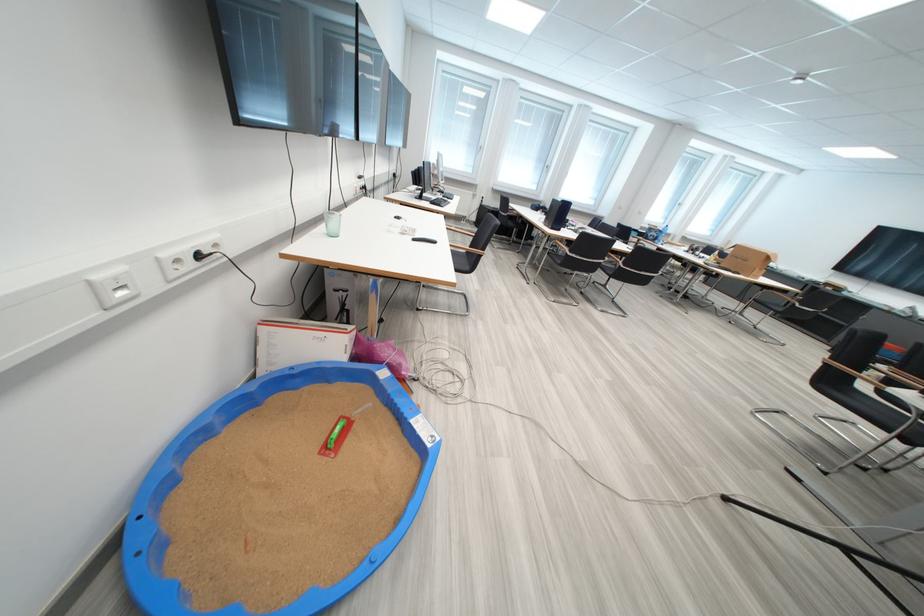
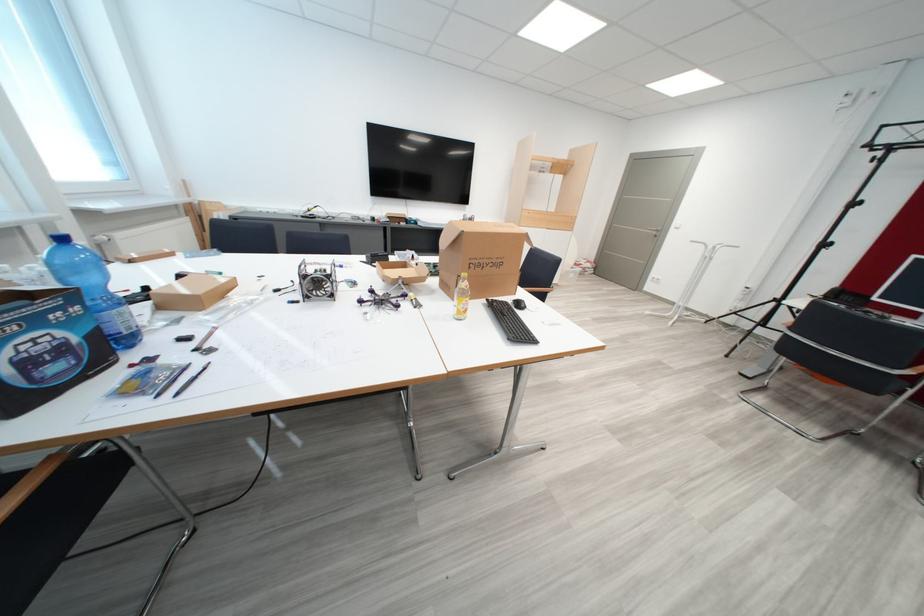
Question: I am providing you with two images of the same scene from different viewpoints. After the viewpoint changes to image2, which objects are now occluded?

Choices:
 (A) cardboard box
 (B) gold bottle cap
 (C) small plastic package
 (D) chrome chair armrest

Answer: (A)